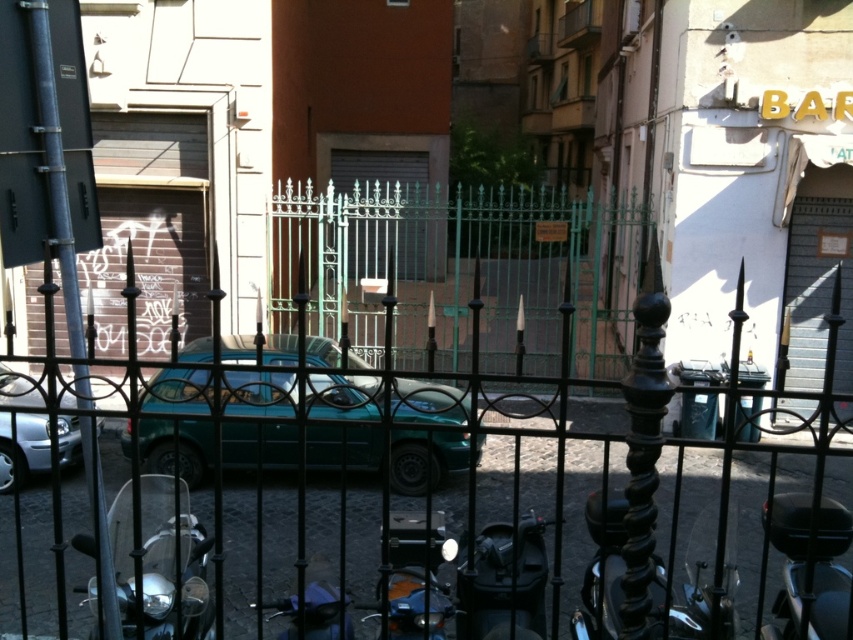
Question: Which point is closer to the camera?

Choices:
 (A) (662, 528)
 (B) (10, 440)
 (C) (498, 611)
 (D) (169, 452)

Answer: (C)

Question: Can you confirm if black wrought iron fence at center is positioned to the left of metallic silver car at left?

Choices:
 (A) no
 (B) yes

Answer: (A)

Question: Which point appears closest to the camera in this image?

Choices:
 (A) (144, 625)
 (B) (173, 624)
 (C) (445, 608)

Answer: (A)

Question: Is black wrought iron fence at center thinner than green wrought iron gate at center?

Choices:
 (A) no
 (B) yes

Answer: (A)

Question: Which point is farther to the camera?

Choices:
 (A) (821, 589)
 (B) (373, 352)
 (C) (198, 621)
 (D) (44, 456)

Answer: (B)

Question: Is teal matte car at center smaller than black matte motorcycle at lower right?

Choices:
 (A) no
 (B) yes

Answer: (A)